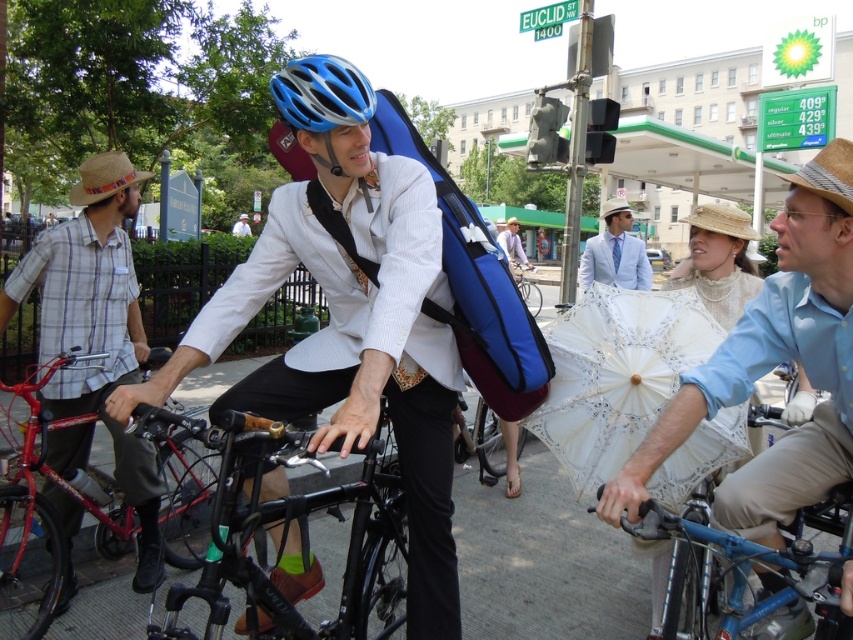
You are a city planner analyzing the image to improve pedestrian safety. The gray concrete pavement at center and the plaid cotton shirt at left are both visible in the scene. Which of these two objects takes up more area in the image?

The plaid cotton shirt at left occupies more space in the image than the gray concrete pavement at center according to the description.

You are a photographer standing at the street corner near the gas station. You want to capture a photo of the light blue cotton shirt at center and the black matte bicycle at center. Based on their heights, which one will appear taller in the photo?

The light blue cotton shirt at center has a greater height compared to the black matte bicycle at center, so it will appear taller in the photo.

You are a photographer standing at the street corner near the gas station. You want to take a photo of the white lace umbrella at center and the light blue fabric suit at center in the same frame. Given that your camera has a maximum focus range of 35 inches, will both subjects be in focus?

The white lace umbrella at center and light blue fabric suit at center are 34.88 inches apart from each other, which is within the camera maximum focus range of 35 inches. Therefore, both subjects will be in focus.